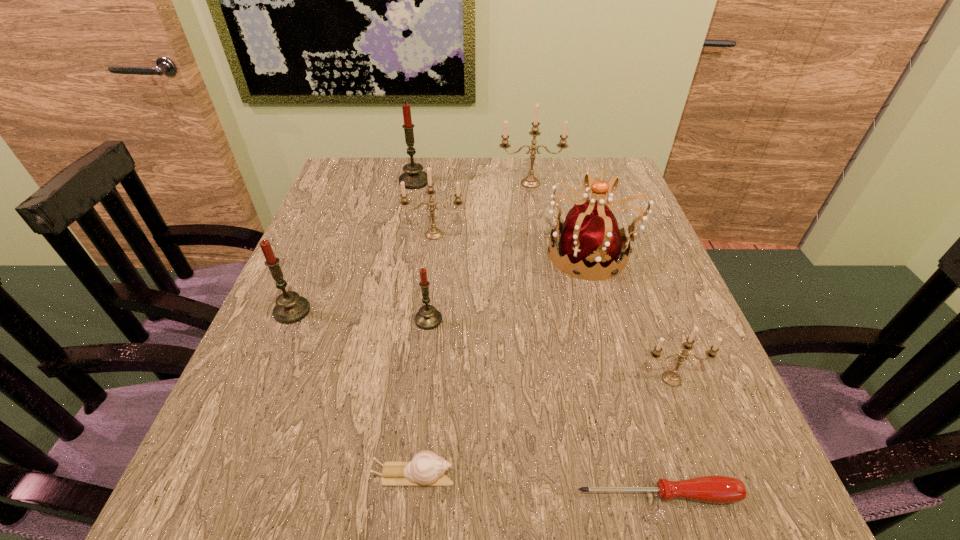
In order to click on candle that is positioned at the right edge in this screenshot , I will do `click(672, 378)`.

Find the location of a particular element. screwdriver located in the right edge section of the desktop is located at coordinates (716, 489).

The width and height of the screenshot is (960, 540). Identify the location of object positioned at the near right corner. (716, 489).

The height and width of the screenshot is (540, 960). Find the location of `vacant point at the far edge`. vacant point at the far edge is located at coordinates (433, 181).

Locate an element on the screen. free region at the near edge is located at coordinates (324, 481).

This screenshot has width=960, height=540. In order to click on blank space at the left edge of the desktop in this screenshot , I will do `click(321, 347)`.

Where is `vacant region at the right edge of the desktop`? This screenshot has height=540, width=960. vacant region at the right edge of the desktop is located at coordinates (614, 205).

The image size is (960, 540). In the image, there is a desktop. In order to click on vacant region at the far left corner in this screenshot , I will do 358,163.

Locate an element on the screen. Image resolution: width=960 pixels, height=540 pixels. blank space at the near left corner of the desktop is located at coordinates (173, 524).

The image size is (960, 540). I want to click on vacant area at the far right corner of the desktop, so click(x=578, y=189).